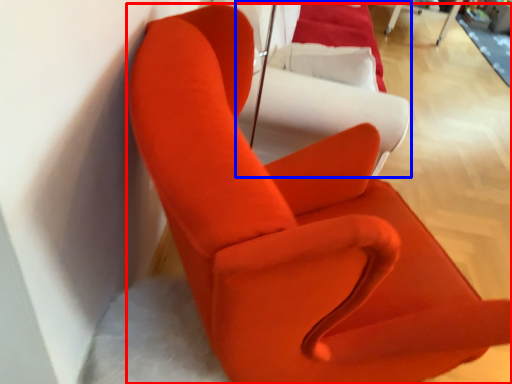
Question: Which of the following is the closest to the observer, chair (highlighted by a red box) or couch (highlighted by a blue box)?

Choices:
 (A) chair
 (B) couch

Answer: (A)